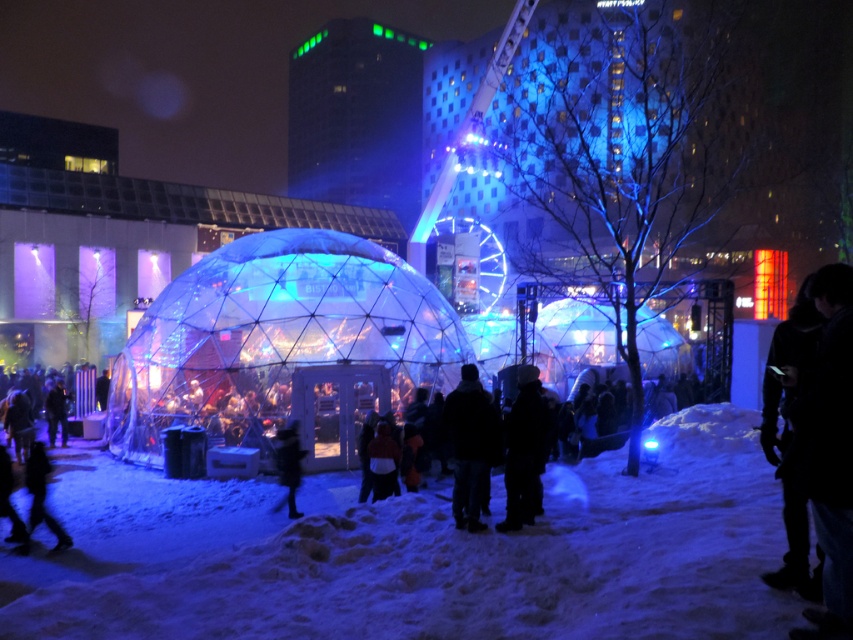
Question: Which object is closer to the camera taking this photo?

Choices:
 (A) white powdery snow at center
 (B) black fuzzy coat at lower center
 (C) dark wool coat at center
 (D) black woolen hat at center

Answer: (A)

Question: Which is farther from the dark wool coat at center?

Choices:
 (A) white powdery snow at center
 (B) black woolen hat at center
 (C) black fuzzy coat at lower center

Answer: (C)

Question: Can you confirm if dark wool coat at center is thinner than black fuzzy coat at lower center?

Choices:
 (A) yes
 (B) no

Answer: (B)

Question: Does white powdery snow at center appear on the left side of dark wool coat at center?

Choices:
 (A) no
 (B) yes

Answer: (A)

Question: Is black woolen hat at center to the right of black fuzzy coat at lower center from the viewer's perspective?

Choices:
 (A) no
 (B) yes

Answer: (B)

Question: Estimate the real-world distances between objects in this image. Which object is farther from the black woolen hat at center?

Choices:
 (A) white powdery snow at center
 (B) dark wool coat at center
 (C) black fuzzy coat at lower center

Answer: (C)